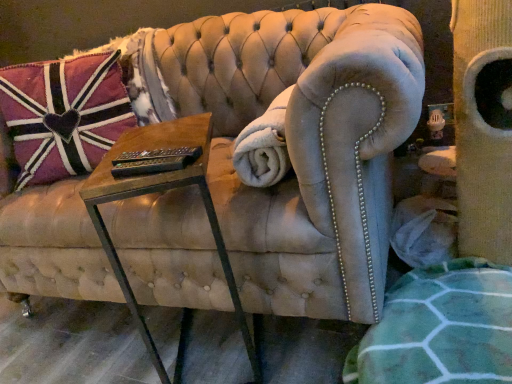
Describe the element at coordinates (264, 146) in the screenshot. I see `white fluffy blanket at center` at that location.

Where is `woodenmaterial/texturetable at center`? woodenmaterial/texturetable at center is located at coordinates (161, 191).

Can you confirm if pink fabric pillow at upper left is positioned to the left of woodenmaterial/texturetable at center?

Correct, you'll find pink fabric pillow at upper left to the left of woodenmaterial/texturetable at center.

How far apart are pink fabric pillow at upper left and woodenmaterial/texturetable at center?

20.94 inches.

Based on the photo, from the image's perspective, relative to woodenmaterial/texturetable at center, is pink fabric pillow at upper left above or below?

Clearly, from the image's perspective, pink fabric pillow at upper left is above woodenmaterial/texturetable at center.

Between pink fabric pillow at upper left and woodenmaterial/texturetable at center, which one has smaller width?

pink fabric pillow at upper left is thinner.

In the image, is woodenmaterial/texturetable at center on the left side or the right side of pink fabric pillow at upper left?

woodenmaterial/texturetable at center is positioned on pink fabric pillow at upper left's right side.

Considering the sizes of objects woodenmaterial/texturetable at center and pink fabric pillow at upper left in the image provided, who is taller, woodenmaterial/texturetable at center or pink fabric pillow at upper left?

woodenmaterial/texturetable at center is taller.

Which of these two, woodenmaterial/texturetable at center or pink fabric pillow at upper left, is bigger?

pink fabric pillow at upper left.

Which of these two, woodenmaterial/texturetable at center or white fluffy blanket at center, is thinner?

With smaller width is white fluffy blanket at center.

From the image's perspective, is woodenmaterial/texturetable at center under white fluffy blanket at center?

Yes.

Can you tell me how much woodenmaterial/texturetable at center and white fluffy blanket at center differ in facing direction?

71.8 degrees.

Which object is positioned more to the left, woodenmaterial/texturetable at center or white fluffy blanket at center?

woodenmaterial/texturetable at center.

Is pink fabric pillow at upper left closer to the viewer compared to white fluffy blanket at center?

No, it is behind white fluffy blanket at center.

From the image's perspective, who appears lower, pink fabric pillow at upper left or white fluffy blanket at center?

white fluffy blanket at center is shown below in the image.

Are pink fabric pillow at upper left and white fluffy blanket at center beside each other?

No, pink fabric pillow at upper left is not next to white fluffy blanket at center.

You are a GUI agent. You are given a task and a screenshot of the screen. Output one action in this format:
    pyautogui.click(x=<x>, y=<y>)
    Task: Click on the blanket located above the woodenmaterial/texturetable at center (from a real-world perspective)
    
    Given the screenshot: What is the action you would take?
    pyautogui.click(x=264, y=146)

Is the position of white fluffy blanket at center more distant than that of woodenmaterial/texturetable at center?

Yes, it is behind woodenmaterial/texturetable at center.

Is white fluffy blanket at center located outside woodenmaterial/texturetable at center?

Indeed, white fluffy blanket at center is completely outside woodenmaterial/texturetable at center.

Is white fluffy blanket at center next to pink fabric pillow at upper left?

white fluffy blanket at center and pink fabric pillow at upper left are clearly separated.

Where is `blanket on the right of pink fabric pillow at upper left`? blanket on the right of pink fabric pillow at upper left is located at coordinates pos(264,146).

From the image's perspective, is white fluffy blanket at center beneath pink fabric pillow at upper left?

Yes.

Is white fluffy blanket at center aimed at pink fabric pillow at upper left?

Yes, white fluffy blanket at center is aimed at pink fabric pillow at upper left.

You are a GUI agent. You are given a task and a screenshot of the screen. Output one action in this format:
    pyautogui.click(x=<x>, y=<y>)
    Task: Click on the pillow behind the woodenmaterial/texturetable at center
    The height and width of the screenshot is (384, 512).
    Given the screenshot: What is the action you would take?
    pos(63,115)

Where is `table directly beneath the pink fabric pillow at upper left (from a real-world perspective)`? Image resolution: width=512 pixels, height=384 pixels. table directly beneath the pink fabric pillow at upper left (from a real-world perspective) is located at coordinates (161, 191).

From the image, which object appears to be nearer to white fluffy blanket at center, pink fabric pillow at upper left or woodenmaterial/texturetable at center?

woodenmaterial/texturetable at center is closer to white fluffy blanket at center.

From the image, which object appears to be nearer to woodenmaterial/texturetable at center, white fluffy blanket at center or pink fabric pillow at upper left?

The object closer to woodenmaterial/texturetable at center is white fluffy blanket at center.

Looking at the image, which one is located closer to woodenmaterial/texturetable at center, pink fabric pillow at upper left or white fluffy blanket at center?

white fluffy blanket at center is closer to woodenmaterial/texturetable at center.

Looking at this image, from the image, which object appears to be farther from pink fabric pillow at upper left, woodenmaterial/texturetable at center or white fluffy blanket at center?

white fluffy blanket at center is further to pink fabric pillow at upper left.

Based on their spatial positions, is white fluffy blanket at center or woodenmaterial/texturetable at center further from pink fabric pillow at upper left?

white fluffy blanket at center is further to pink fabric pillow at upper left.

In the scene shown: Which object lies nearer to the anchor point white fluffy blanket at center, woodenmaterial/texturetable at center or pink fabric pillow at upper left?

Among the two, woodenmaterial/texturetable at center is located nearer to white fluffy blanket at center.

Locate an element on the screen. table between pink fabric pillow at upper left and white fluffy blanket at center is located at coordinates (161, 191).